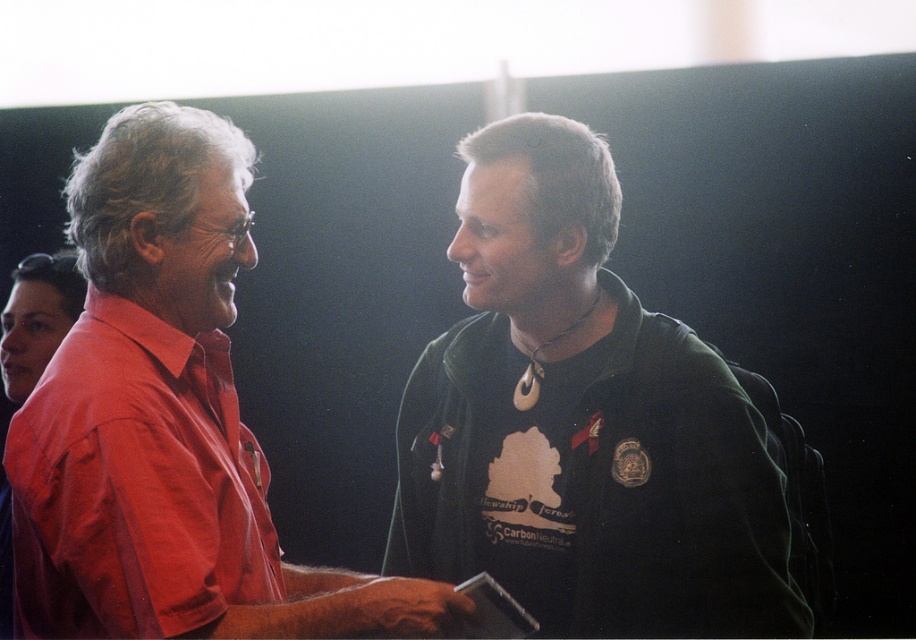
Question: Does black matte shirt at center have a larger size compared to matte red shirt at left?

Choices:
 (A) no
 (B) yes

Answer: (A)

Question: Considering the relative positions of black matte shirt at center and matte red shirt at left in the image provided, where is black matte shirt at center located with respect to matte red shirt at left?

Choices:
 (A) left
 (B) right

Answer: (B)

Question: Observing the image, what is the correct spatial positioning of black matte shirt at center in reference to matte red shirt at left?

Choices:
 (A) below
 (B) above

Answer: (A)

Question: Which point is closer to the camera?

Choices:
 (A) (611, 602)
 (B) (172, 512)

Answer: (B)